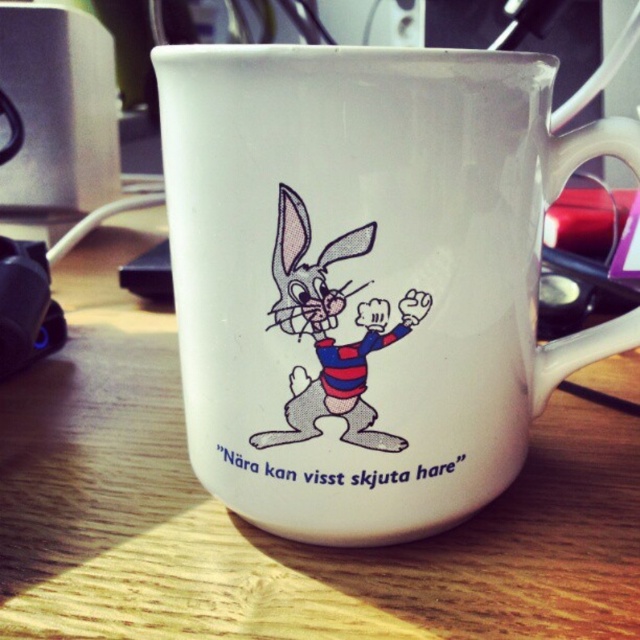
Who is lower down, white ceramic mug at center or cartoon rabbit at center?

cartoon rabbit at center is below.

Which is in front, point (438, 60) or point (332, 346)?

Point (438, 60) is in front.

Identify the location of white ceramic mug at center. The width and height of the screenshot is (640, 640). (365, 276).

Which is more to the left, wooden table at center or cartoon rabbit at center?

wooden table at center

Looking at this image, does wooden table at center have a greater height compared to cartoon rabbit at center?

Yes.

Identify the location of wooden table at center. The height and width of the screenshot is (640, 640). (266, 532).

Identify the location of wooden table at center. The width and height of the screenshot is (640, 640). (266, 532).

The image size is (640, 640). What do you see at coordinates (365, 276) in the screenshot? I see `white ceramic mug at center` at bounding box center [365, 276].

Can you confirm if white ceramic mug at center is positioned below wooden table at center?

No.

Is point (492, 148) less distant than point (540, 454)?

That is True.

At what (x,y) coordinates should I click in order to perform the action: click on white ceramic mug at center. Please return your answer as a coordinate pair (x, y). Image resolution: width=640 pixels, height=640 pixels. Looking at the image, I should click on (365, 276).